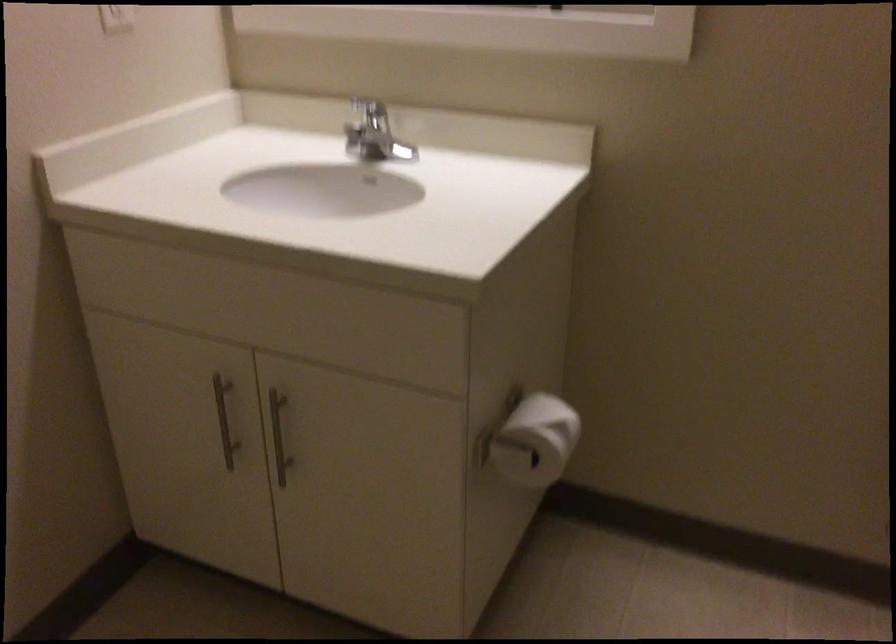
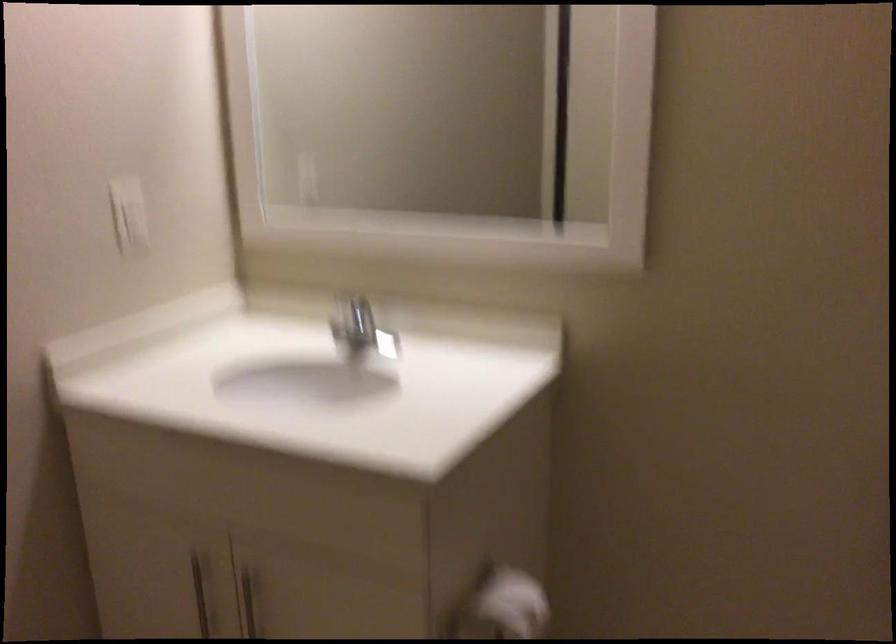
In the second image, find the point that corresponds to pixel 543 415 in the first image.

(511, 603)